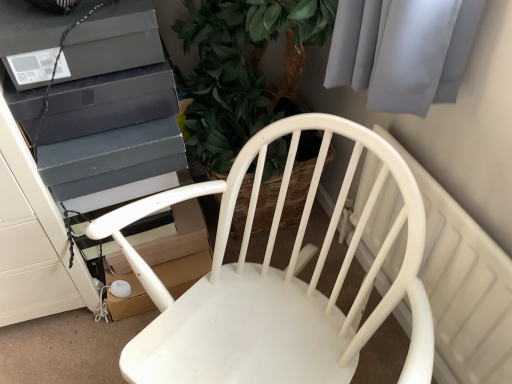
The image size is (512, 384). I want to click on matte black box at upper left, which is counted as the 2th appliance, starting from the top, so click(109, 102).

In order to face matte black speaker at upper left, marked as the first appliance in a top-to-bottom arrangement, should I rotate leftwards or rightwards?

You should look left and rotate roughly 22.428 degrees.

Measure the distance between white matte chair at center and camera.

The distance of white matte chair at center from camera is 23.02 inches.

The height and width of the screenshot is (384, 512). What do you see at coordinates (463, 287) in the screenshot?
I see `white plastic radiator at upper right` at bounding box center [463, 287].

In order to face white plastic radiator at upper right, should I rotate leftwards or rightwards?

Rotate right and turn 19.990 degrees.

Where is `matte black box at upper left, which is counted as the 2th appliance, starting from the top`? This screenshot has width=512, height=384. matte black box at upper left, which is counted as the 2th appliance, starting from the top is located at coordinates (x=109, y=102).

Is point (86, 12) closer or farther from the camera than point (85, 88)?

Point (86, 12).

Is matte black speaker at upper left, marked as the first appliance in a top-to-bottom arrangement, positioned with its back to matte black box at upper left, which is counted as the first appliance, starting from the bottom?

No, matte black speaker at upper left, marked as the first appliance in a top-to-bottom arrangement, is not facing away from matte black box at upper left, which is counted as the first appliance, starting from the bottom.

Can you tell me how much matte black speaker at upper left, the second appliance ordered from the bottom, and matte black box at upper left, which is counted as the first appliance, starting from the bottom, differ in facing direction?

The angle between the facing direction of matte black speaker at upper left, the second appliance ordered from the bottom, and the facing direction of matte black box at upper left, which is counted as the first appliance, starting from the bottom, is 0.000557 degrees.

Which object is further away from the camera, matte black speaker at upper left, the second appliance ordered from the bottom, or matte black box at upper left, which is counted as the first appliance, starting from the bottom?

Positioned behind is matte black box at upper left, which is counted as the first appliance, starting from the bottom.

Does matte black box at upper left, which is counted as the 2th appliance, starting from the top, have a greater height compared to white matte chair at center?

Incorrect, the height of matte black box at upper left, which is counted as the 2th appliance, starting from the top, is not larger of that of white matte chair at center.

Which is behind, point (76, 92) or point (353, 124)?

Positioned behind is point (76, 92).

Is matte black box at upper left, which is counted as the 2th appliance, starting from the top, positioned with its back to white matte chair at center?

No, matte black box at upper left, which is counted as the 2th appliance, starting from the top, is not facing the opposite direction of white matte chair at center.

Which object is positioned more to the right, white matte chair at center or white plastic radiator at upper right?

white plastic radiator at upper right.

Is white matte chair at center beside white plastic radiator at upper right?

No.

From the picture: From the image's perspective, between white matte chair at center and white plastic radiator at upper right, who is located below?

white matte chair at center.

Is white matte chair at center positioned behind white plastic radiator at upper right?

No, white matte chair at center is in front of white plastic radiator at upper right.

Find the location of a particular element. radiator below the matte black box at upper left, which is counted as the first appliance, starting from the bottom (from the image's perspective) is located at coordinates (463, 287).

What's the angular difference between matte black box at upper left, which is counted as the first appliance, starting from the bottom, and white plastic radiator at upper right's facing directions?

91.2 degrees.

Considering the positions of points (168, 77) and (461, 212), is point (168, 77) closer to camera compared to point (461, 212)?

No, it is behind (461, 212).

Does white matte chair at center have a lesser width compared to matte black speaker at upper left, the second appliance ordered from the bottom?

No, white matte chair at center is not thinner than matte black speaker at upper left, the second appliance ordered from the bottom.

Do you think white matte chair at center is within matte black speaker at upper left, the second appliance ordered from the bottom, or outside of it?

white matte chair at center is not inside matte black speaker at upper left, the second appliance ordered from the bottom, it's outside.

Are white matte chair at center and matte black speaker at upper left, marked as the first appliance in a top-to-bottom arrangement, located far from each other?

No.

Measure the distance between white matte chair at center and matte black speaker at upper left, marked as the first appliance in a top-to-bottom arrangement.

The distance of white matte chair at center from matte black speaker at upper left, marked as the first appliance in a top-to-bottom arrangement, is 18.28 inches.

Is white matte chair at center bigger or smaller than matte black box at upper left, which is counted as the first appliance, starting from the bottom?

white matte chair at center is bigger than matte black box at upper left, which is counted as the first appliance, starting from the bottom.

Are white matte chair at center and matte black box at upper left, which is counted as the 2th appliance, starting from the top, far apart?

white matte chair at center is near matte black box at upper left, which is counted as the 2th appliance, starting from the top, not far away.

Which is closer to the camera, [240,175] or [106,104]?

The point [240,175] is in front.

From the image's perspective, between matte black box at upper left, which is counted as the first appliance, starting from the bottom, and matte black speaker at upper left, the second appliance ordered from the bottom, which one is located above?

From the image's view, matte black speaker at upper left, the second appliance ordered from the bottom, is above.

The width and height of the screenshot is (512, 384). Find the location of `appliance that appears below the matte black speaker at upper left, the second appliance ordered from the bottom (from the image's perspective)`. appliance that appears below the matte black speaker at upper left, the second appliance ordered from the bottom (from the image's perspective) is located at coordinates (109, 102).

Is matte black box at upper left, which is counted as the 2th appliance, starting from the top, inside or outside of matte black speaker at upper left, the second appliance ordered from the bottom?

matte black box at upper left, which is counted as the 2th appliance, starting from the top, is outside matte black speaker at upper left, the second appliance ordered from the bottom.

Which object is wider, matte black box at upper left, which is counted as the 2th appliance, starting from the top, or matte black speaker at upper left, marked as the first appliance in a top-to-bottom arrangement?

matte black box at upper left, which is counted as the 2th appliance, starting from the top, is wider.

The height and width of the screenshot is (384, 512). Find the location of `appliance that appears in front of the matte black box at upper left, which is counted as the first appliance, starting from the bottom`. appliance that appears in front of the matte black box at upper left, which is counted as the first appliance, starting from the bottom is located at coordinates pyautogui.click(x=112, y=42).

You are a GUI agent. You are given a task and a screenshot of the screen. Output one action in this format:
    pyautogui.click(x=<x>, y=<y>)
    Task: Click on the 2nd appliance behind the white matte chair at center, counting from the anchor's position
    Image resolution: width=512 pixels, height=384 pixels.
    Given the screenshot: What is the action you would take?
    pyautogui.click(x=109, y=102)

Looking at the image, which one is located closer to matte black speaker at upper left, marked as the first appliance in a top-to-bottom arrangement, white matte chair at center or matte black box at upper left, which is counted as the 2th appliance, starting from the top?

Among the two, matte black box at upper left, which is counted as the 2th appliance, starting from the top, is located nearer to matte black speaker at upper left, marked as the first appliance in a top-to-bottom arrangement.

Considering their positions, is matte black box at upper left, which is counted as the 2th appliance, starting from the top, positioned closer to white plastic radiator at upper right than white matte chair at center?

Based on the image, white matte chair at center appears to be nearer to white plastic radiator at upper right.

Consider the image. From the image, which object appears to be farther from matte black box at upper left, which is counted as the 2th appliance, starting from the top, white matte chair at center or matte black speaker at upper left, the second appliance ordered from the bottom?

white matte chair at center.

Which object lies further to the anchor point matte black speaker at upper left, marked as the first appliance in a top-to-bottom arrangement, white matte chair at center or white plastic radiator at upper right?

white plastic radiator at upper right.

Based on their spatial positions, is white plastic radiator at upper right or matte black speaker at upper left, the second appliance ordered from the bottom, further from white matte chair at center?

Among the two, matte black speaker at upper left, the second appliance ordered from the bottom, is located further to white matte chair at center.

Considering their positions, is matte black box at upper left, which is counted as the 2th appliance, starting from the top, positioned closer to matte black speaker at upper left, the second appliance ordered from the bottom, than white matte chair at center?

The object closer to matte black speaker at upper left, the second appliance ordered from the bottom, is matte black box at upper left, which is counted as the 2th appliance, starting from the top.

Based on their spatial positions, is matte black speaker at upper left, marked as the first appliance in a top-to-bottom arrangement, or white matte chair at center further from white plastic radiator at upper right?

Based on the image, matte black speaker at upper left, marked as the first appliance in a top-to-bottom arrangement, appears to be further to white plastic radiator at upper right.

Which object lies further to the anchor point matte black box at upper left, which is counted as the first appliance, starting from the bottom, white plastic radiator at upper right or white matte chair at center?

white plastic radiator at upper right is further to matte black box at upper left, which is counted as the first appliance, starting from the bottom.

This screenshot has height=384, width=512. Find the location of `chair located between matte black box at upper left, which is counted as the 2th appliance, starting from the top, and white plastic radiator at upper right in the left-right direction`. chair located between matte black box at upper left, which is counted as the 2th appliance, starting from the top, and white plastic radiator at upper right in the left-right direction is located at coordinates (275, 283).

Identify the location of appliance between matte black speaker at upper left, the second appliance ordered from the bottom, and white matte chair at center from top to bottom. (109, 102).

The image size is (512, 384). I want to click on chair between matte black speaker at upper left, marked as the first appliance in a top-to-bottom arrangement, and white plastic radiator at upper right, so click(x=275, y=283).

The image size is (512, 384). I want to click on appliance located between matte black speaker at upper left, the second appliance ordered from the bottom, and white plastic radiator at upper right in the left-right direction, so click(109, 102).